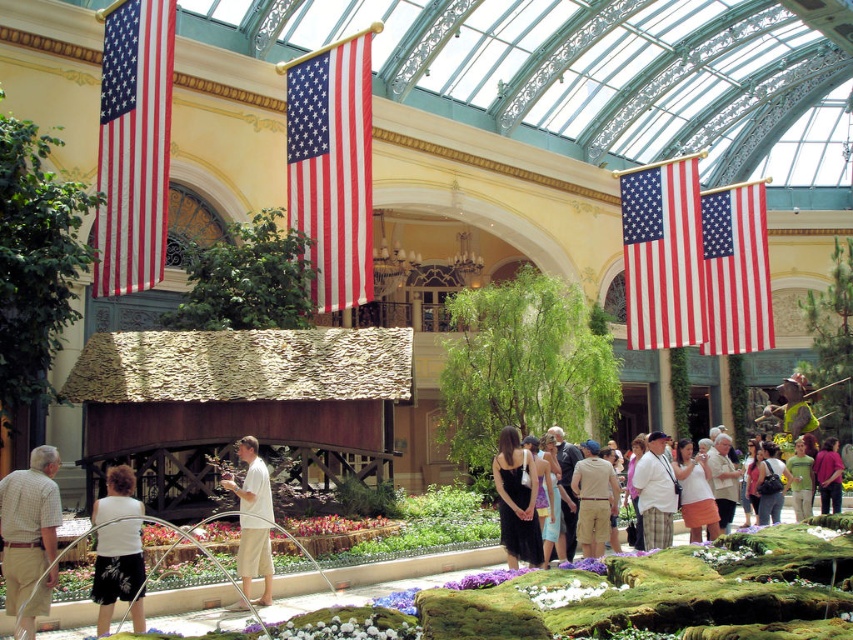
Question: Can you confirm if red/white striped flag at center is thinner than matte red-white-blue flag at upper right?

Choices:
 (A) yes
 (B) no

Answer: (A)

Question: Which of the following is the closest to the observer?

Choices:
 (A) (706, 484)
 (B) (325, 524)
 (C) (653, 273)

Answer: (B)

Question: Which of the following is the farthest from the observer?

Choices:
 (A) (663, 221)
 (B) (689, 525)
 (C) (257, 474)
 (D) (350, 259)

Answer: (A)

Question: Is red/white striped flag at upper right positioned before white cotton shirt at center?

Choices:
 (A) no
 (B) yes

Answer: (A)

Question: Does red/white striped fabric flag at upper left have a lesser width compared to matte red-white-blue flag at upper right?

Choices:
 (A) no
 (B) yes

Answer: (B)

Question: Which object is the farthest from the white cotton shirt at center?

Choices:
 (A) matte white blouse at center
 (B) matte red-white-blue flag at upper right

Answer: (B)